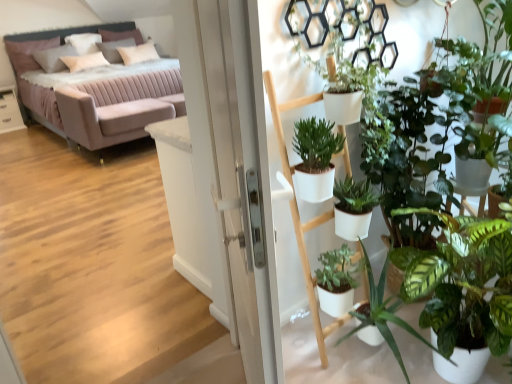
What is the approximate height of matte pink pillow at upper left, the fourth pillow positioned from the right?

matte pink pillow at upper left, the fourth pillow positioned from the right, is 23.60 inches tall.

In order to face white glossy screen door at center, should I rotate leftwards or rightwards?

A 2.415 degree turn to the left will do.

What do you see at coordinates (241, 179) in the screenshot? The width and height of the screenshot is (512, 384). I see `white glossy screen door at center` at bounding box center [241, 179].

Locate an element on the screen. This screenshot has height=384, width=512. velvet pink couch at upper left is located at coordinates (95, 92).

Find the location of a particular element. white soft pillow at upper left, which is the 1th pillow from right to left is located at coordinates (138, 53).

At what (x,y) coordinates should I click in order to perform the action: click on matte pink pillow at upper left, the fourth pillow positioned from the right. Please return your answer as a coordinate pair (x, y). Looking at the image, I should click on (27, 53).

Based on their positions, is white soft pillow at upper left, the fourth pillow viewed from the left, located to the left or right of matte pink pillow at upper left, acting as the 1th pillow starting from the left?

Clearly, white soft pillow at upper left, the fourth pillow viewed from the left, is on the right of matte pink pillow at upper left, acting as the 1th pillow starting from the left, in the image.

Is the position of white soft pillow at upper left, which is the 1th pillow from right to left, more distant than that of matte pink pillow at upper left, the fourth pillow positioned from the right?

Yes, white soft pillow at upper left, which is the 1th pillow from right to left, is further from the viewer.

From a real-world perspective, who is located lower, white soft pillow at upper left, which is the 1th pillow from right to left, or matte pink pillow at upper left, the fourth pillow positioned from the right?

From a 3D spatial view, matte pink pillow at upper left, the fourth pillow positioned from the right, is below.

Considering the sizes of objects white soft pillow at upper left, which is the 1th pillow from right to left, and matte pink pillow at upper left, acting as the 1th pillow starting from the left, in the image provided, who is thinner, white soft pillow at upper left, which is the 1th pillow from right to left, or matte pink pillow at upper left, acting as the 1th pillow starting from the left,?

white soft pillow at upper left, which is the 1th pillow from right to left, is thinner.

Is white glossy screen door at center at the left side of velvet pink couch at upper left?

In fact, white glossy screen door at center is to the right of velvet pink couch at upper left.

Is the depth of white glossy screen door at center greater than that of velvet pink couch at upper left?

No, white glossy screen door at center is closer to the camera.

In the scene shown: From the image's perspective, which is below, white glossy screen door at center or velvet pink couch at upper left?

From the image's view, white glossy screen door at center is below.

Is white glossy screen door at center turned away from velvet pink couch at upper left?

white glossy screen door at center does not have its back to velvet pink couch at upper left.

Is white soft pillow at upper left, the third pillow viewed from the left, aimed at velvet pink couch at upper left?

Yes, white soft pillow at upper left, the third pillow viewed from the left, is aimed at velvet pink couch at upper left.

From the picture: Is white soft pillow at upper left, acting as the 2th pillow starting from the right, far away from velvet pink couch at upper left?

white soft pillow at upper left, acting as the 2th pillow starting from the right, is far away from velvet pink couch at upper left.

Is point (14, 108) less distant than point (61, 85)?

No, it is behind (61, 85).

Is white glossy table at left surrounding velvet pink couch at upper left?

That's incorrect, velvet pink couch at upper left is not inside white glossy table at left.

Would you consider white glossy table at left to be distant from velvet pink couch at upper left?

Absolutely, white glossy table at left is distant from velvet pink couch at upper left.

Is white glossy table at left smaller than velvet pink couch at upper left?

Yes.

Does point (222, 6) lie behind point (97, 53)?

No, (222, 6) is closer to viewer.

Is white glossy screen door at center smaller than velvet pink couch at upper left?

Indeed, white glossy screen door at center has a smaller size compared to velvet pink couch at upper left.

Is white glossy screen door at center located outside velvet pink couch at upper left?

white glossy screen door at center is positioned outside velvet pink couch at upper left.

Which of these two, white glossy screen door at center or velvet pink couch at upper left, stands shorter?

Standing shorter between the two is velvet pink couch at upper left.

Where is `the 2nd pillow positioned above the white glossy screen door at center (from a real-world perspective)`? the 2nd pillow positioned above the white glossy screen door at center (from a real-world perspective) is located at coordinates (138, 53).

Between white soft pillow at upper left, the fourth pillow viewed from the left, and white glossy screen door at center, which one has more height?

With more height is white glossy screen door at center.

Is white soft pillow at upper left, the fourth pillow viewed from the left, oriented towards white glossy screen door at center?

Yes, white soft pillow at upper left, the fourth pillow viewed from the left, faces towards white glossy screen door at center.

Which of these two, white soft pillow at upper left, which is the 1th pillow from right to left, or white glossy screen door at center, is wider?

white soft pillow at upper left, which is the 1th pillow from right to left.

Is white glossy screen door at center in front of or behind matte pink pillow at upper left, the fourth pillow positioned from the right, in the image?

Clearly, white glossy screen door at center is in front of matte pink pillow at upper left, the fourth pillow positioned from the right.

From a real-world perspective, is white glossy screen door at center on top of matte pink pillow at upper left, the fourth pillow positioned from the right?

No, from a real-world perspective, white glossy screen door at center is not on top of matte pink pillow at upper left, the fourth pillow positioned from the right.

Is white glossy screen door at center next to matte pink pillow at upper left, the fourth pillow positioned from the right?

No, white glossy screen door at center is not making contact with matte pink pillow at upper left, the fourth pillow positioned from the right.

Considering the relative sizes of white glossy screen door at center and matte pink pillow at upper left, the fourth pillow positioned from the right, in the image provided, is white glossy screen door at center smaller than matte pink pillow at upper left, the fourth pillow positioned from the right,?

No.

This screenshot has width=512, height=384. Find the location of `pillow in front of the white soft pillow at upper left, which is the 1th pillow from right to left`. pillow in front of the white soft pillow at upper left, which is the 1th pillow from right to left is located at coordinates (27, 53).

The image size is (512, 384). What are the coordinates of `screen door below the velvet pink couch at upper left (from the image's perspective)` in the screenshot? It's located at (241, 179).

Which object lies nearer to the anchor point matte pink pillow at upper left, the fourth pillow positioned from the right, white soft pillow at upper left, positioned as the 3th pillow in right-to-left order, or white glossy screen door at center?

white soft pillow at upper left, positioned as the 3th pillow in right-to-left order.

Based on their spatial positions, is velvet pink couch at upper left or white soft pillow at upper left, acting as the 2th pillow starting from the right, closer to white glossy table at left?

velvet pink couch at upper left is positioned closer to the anchor white glossy table at left.

Estimate the real-world distances between objects in this image. Which object is further from white soft pillow at upper left, acting as the 2th pillow starting from the right, velvet pink couch at upper left or white glossy table at left?

Based on the image, white glossy table at left appears to be further to white soft pillow at upper left, acting as the 2th pillow starting from the right.

Based on their spatial positions, is white glossy screen door at center or velvet pink couch at upper left further from matte pink pillow at upper left, acting as the 1th pillow starting from the left?

white glossy screen door at center is further to matte pink pillow at upper left, acting as the 1th pillow starting from the left.

From the image, which object appears to be nearer to velvet pink couch at upper left, white glossy table at left or white glossy screen door at center?

Based on the image, white glossy table at left appears to be nearer to velvet pink couch at upper left.

From the image, which object appears to be farther from white soft pillow at upper left, which is counted as the second pillow, starting from the left, white glossy table at left or white soft pillow at upper left, the fourth pillow viewed from the left?

Among the two, white glossy table at left is located further to white soft pillow at upper left, which is counted as the second pillow, starting from the left.

Based on their spatial positions, is velvet pink couch at upper left or white soft pillow at upper left, the fourth pillow viewed from the left, further from white glossy table at left?

Based on the image, white soft pillow at upper left, the fourth pillow viewed from the left, appears to be further to white glossy table at left.

Which object lies nearer to the anchor point velvet pink couch at upper left, velvet pink couch at upper left or white soft pillow at upper left, acting as the 2th pillow starting from the right?

Among the two, velvet pink couch at upper left is located nearer to velvet pink couch at upper left.

Locate an element on the screen. This screenshot has width=512, height=384. pillow between velvet pink couch at upper left and white soft pillow at upper left, which is the 1th pillow from right to left, along the z-axis is located at coordinates (27, 53).

At what (x,y) coordinates should I click in order to perform the action: click on studio couch between white glossy screen door at center and white soft pillow at upper left, which is counted as the second pillow, starting from the left, in the front-back direction. Please return your answer as a coordinate pair (x, y). The width and height of the screenshot is (512, 384). Looking at the image, I should click on (95, 92).

The image size is (512, 384). What are the coordinates of `pillow between matte pink pillow at upper left, acting as the 1th pillow starting from the left, and white soft pillow at upper left, acting as the 2th pillow starting from the right, from left to right` in the screenshot? It's located at click(x=84, y=42).

This screenshot has height=384, width=512. In order to click on table positioned between velvet pink couch at upper left and white soft pillow at upper left, which is counted as the second pillow, starting from the left, from near to far in this screenshot , I will do click(x=10, y=110).